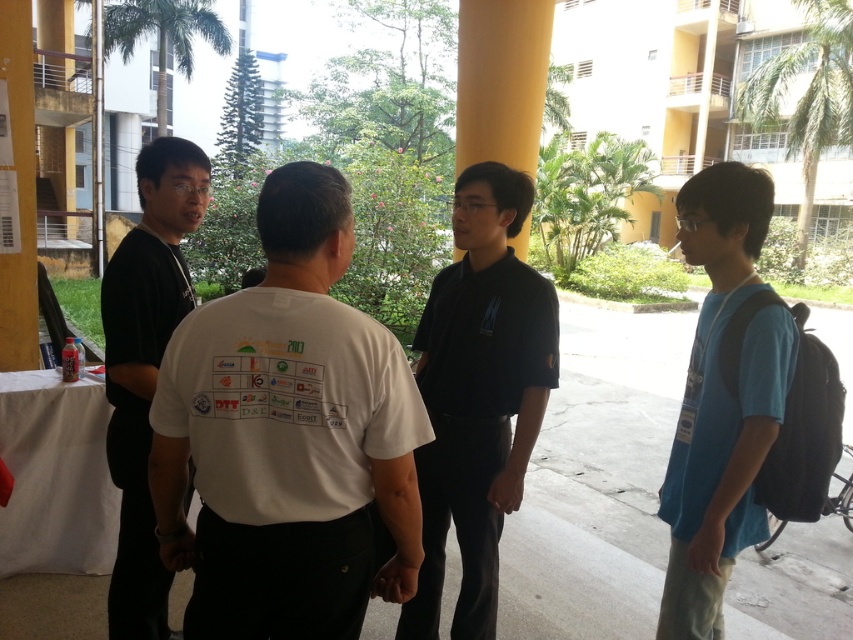
Is black matte shirt at center above blue cotton t-shirt at right?

No, black matte shirt at center is not above blue cotton t-shirt at right.

Is black matte shirt at center to the right of blue cotton t-shirt at right from the viewer's perspective?

Incorrect, black matte shirt at center is not on the right side of blue cotton t-shirt at right.

Find the location of a particular element. The height and width of the screenshot is (640, 853). black matte shirt at center is located at coordinates (479, 396).

Is point (450, 484) less distant than point (165, 618)?

That is True.

Who is more forward, [485,476] or [207,161]?

Positioned in front is point [485,476].

The image size is (853, 640). Find the location of `black matte shirt at center`. black matte shirt at center is located at coordinates (479, 396).

Who is more distant from viewer, (311, 596) or (525, 429)?

Point (525, 429)

The image size is (853, 640). What do you see at coordinates (287, 436) in the screenshot?
I see `white matte t-shirt at center` at bounding box center [287, 436].

Where is `white matte t-shirt at center`? This screenshot has width=853, height=640. white matte t-shirt at center is located at coordinates (287, 436).